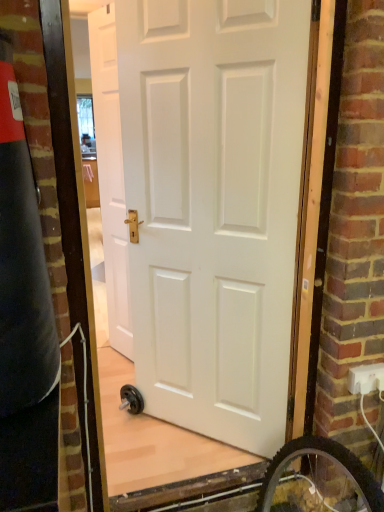
Question: Can you confirm if white plastic electric outlet at lower right is taller than white matte door at center, arranged as the 1th door when viewed from the right?

Choices:
 (A) no
 (B) yes

Answer: (A)

Question: Is white plastic electric outlet at lower right next to white matte door at center, positioned as the 2th door in left-to-right order, and touching it?

Choices:
 (A) no
 (B) yes

Answer: (A)

Question: Is white matte door at center, the 2th door from the back, a part of white plastic electric outlet at lower right?

Choices:
 (A) no
 (B) yes

Answer: (A)

Question: Is white plastic electric outlet at lower right shorter than white matte door at center, positioned as the 2th door in left-to-right order?

Choices:
 (A) no
 (B) yes

Answer: (B)

Question: From the image's perspective, is white plastic electric outlet at lower right above white matte door at center, the 2th door from the back?

Choices:
 (A) no
 (B) yes

Answer: (A)

Question: Is point (117, 136) positioned closer to the camera than point (379, 386)?

Choices:
 (A) closer
 (B) farther

Answer: (B)

Question: Is white matte door at center, arranged as the 2th door when viewed from the front, inside or outside of white plastic electric outlet at lower right?

Choices:
 (A) inside
 (B) outside

Answer: (B)

Question: Considering their positions, is white matte door at center, which is the second door from right to left, located in front of or behind white plastic electric outlet at lower right?

Choices:
 (A) front
 (B) behind

Answer: (B)

Question: From the image's perspective, is white matte door at center, arranged as the 2th door when viewed from the front, above or below white plastic electric outlet at lower right?

Choices:
 (A) above
 (B) below

Answer: (A)

Question: Is white matte door at center, arranged as the 2th door when viewed from the front, in front of or behind white matte door at center, arranged as the 1th door when viewed from the right, in the image?

Choices:
 (A) front
 (B) behind

Answer: (B)

Question: Looking at their shapes, would you say white matte door at center, which is the second door from right to left, is wider or thinner than white matte door at center, arranged as the 1th door when viewed from the right?

Choices:
 (A) wide
 (B) thin

Answer: (B)

Question: Visually, is white matte door at center, which is the first door in left-to-right order, positioned to the left or to the right of white matte door at center, the 2th door from the back?

Choices:
 (A) left
 (B) right

Answer: (A)

Question: In terms of height, does white matte door at center, which is the second door from right to left, look taller or shorter compared to white matte door at center, which is the 1th door in front-to-back order?

Choices:
 (A) tall
 (B) short

Answer: (A)

Question: Is white plastic electric outlet at lower right in front of or behind white matte door at center, arranged as the 1th door when viewed from the right, in the image?

Choices:
 (A) front
 (B) behind

Answer: (B)

Question: Considering the positions of white plastic electric outlet at lower right and white matte door at center, arranged as the 1th door when viewed from the right, in the image, is white plastic electric outlet at lower right taller or shorter than white matte door at center, arranged as the 1th door when viewed from the right,?

Choices:
 (A) tall
 (B) short

Answer: (B)